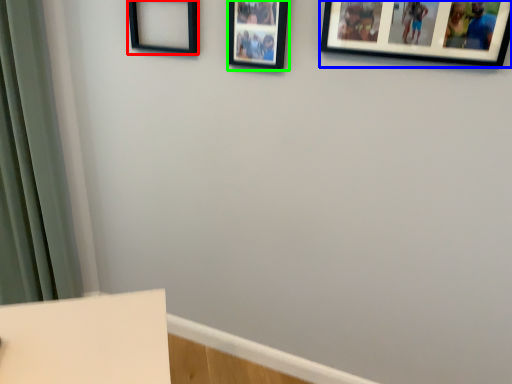
Question: Considering the real-world distances, which object is farthest from picture frame (highlighted by a red box)? picture frame (highlighted by a blue box) or picture frame (highlighted by a green box)?

Choices:
 (A) picture frame
 (B) picture frame

Answer: (A)